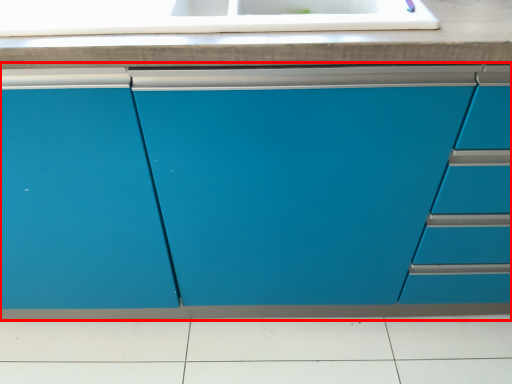
Question: From the image's perspective, what is the correct spatial positioning of cabinetry (annotated by the red box) in reference to countertop?

Choices:
 (A) above
 (B) below

Answer: (B)